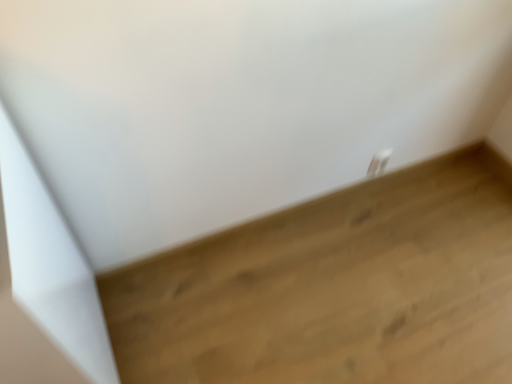
What do you see at coordinates (335, 288) in the screenshot? The height and width of the screenshot is (384, 512). I see `light brown wood flooring at lower right` at bounding box center [335, 288].

Find the location of `light brown wood flooring at lower right`. light brown wood flooring at lower right is located at coordinates (335, 288).

The width and height of the screenshot is (512, 384). I want to click on light brown wood flooring at lower right, so click(x=335, y=288).